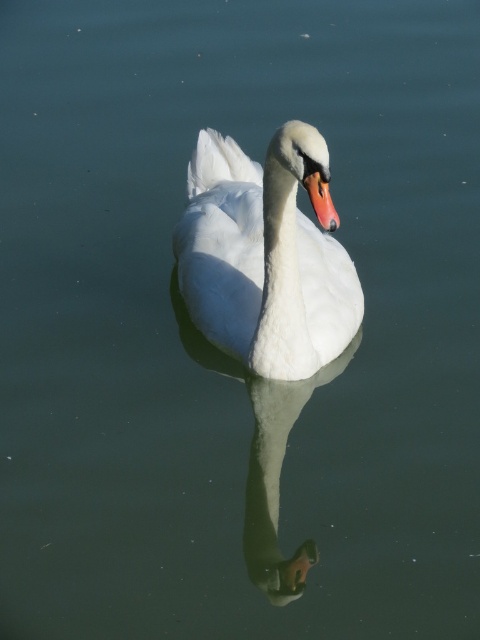
Consider the image. Is white glossy swan at center above white glossy swan neck at center?

Correct, white glossy swan at center is located above white glossy swan neck at center.

Who is taller, white glossy swan at center or white glossy swan neck at center?

Standing taller between the two is white glossy swan at center.

Is point (197, 294) in front of point (256, 566)?

No, (197, 294) is behind (256, 566).

I want to click on white glossy swan at center, so click(x=264, y=257).

Can you confirm if white glossy swan at center is thinner than matte orange beak at center?

In fact, white glossy swan at center might be wider than matte orange beak at center.

Is white glossy swan at center taller than matte orange beak at center?

Indeed, white glossy swan at center has a greater height compared to matte orange beak at center.

Identify the location of white glossy swan at center. (264, 257).

Does white glossy swan neck at center have a lesser height compared to matte orange beak at center?

In fact, white glossy swan neck at center may be taller than matte orange beak at center.

How much distance is there between white glossy swan neck at center and matte orange beak at center?

A distance of 1.03 meters exists between white glossy swan neck at center and matte orange beak at center.

Identify the location of white glossy swan neck at center. (277, 480).

The image size is (480, 640). What are the coordinates of `white glossy swan neck at center` in the screenshot? It's located at (277, 480).